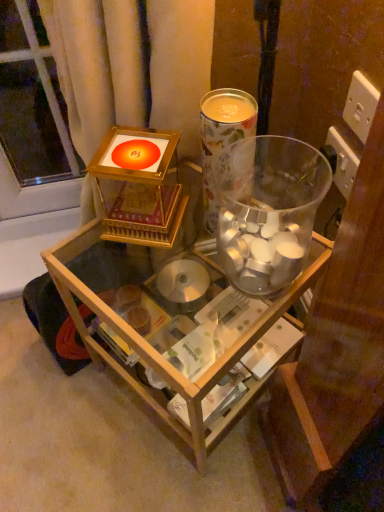
You are a GUI agent. You are given a task and a screenshot of the screen. Output one action in this format:
    pyautogui.click(x=<x>, y=<y>)
    Task: Click on the free space in front of floral paper cup at upper center, placed as the first beverage when sorted from top to bottom
    The height and width of the screenshot is (512, 384).
    Given the screenshot: What is the action you would take?
    pyautogui.click(x=184, y=293)